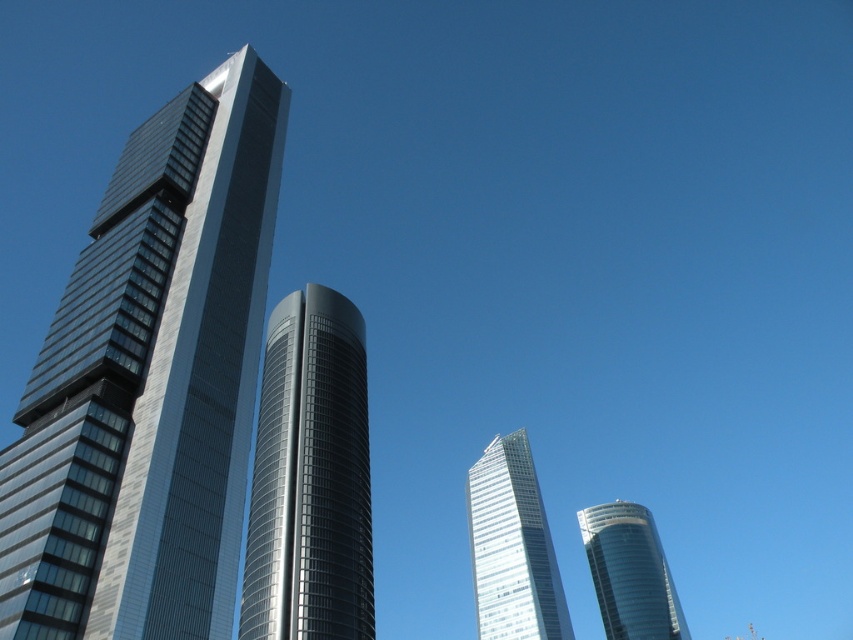
Question: Is glossy glass tower at center below shiny glass tower at lower right?

Choices:
 (A) yes
 (B) no

Answer: (B)

Question: Which of the following is the closest to the observer?

Choices:
 (A) shiny glass skyscraper at left
 (B) glossy glass tower at center
 (C) transparent glass skyscraper at center

Answer: (A)

Question: Based on their relative distances, which object is farther from the shiny glass skyscraper at left?

Choices:
 (A) glossy glass tower at center
 (B) transparent glass skyscraper at center
 (C) shiny glass tower at lower right

Answer: (C)

Question: Does shiny glass skyscraper at left appear on the left side of transparent glass skyscraper at center?

Choices:
 (A) no
 (B) yes

Answer: (B)

Question: Can you confirm if transparent glass skyscraper at center is bigger than shiny glass tower at lower right?

Choices:
 (A) no
 (B) yes

Answer: (B)

Question: Which point appears closest to the camera in this image?

Choices:
 (A) (468, 490)
 (B) (622, 500)

Answer: (A)